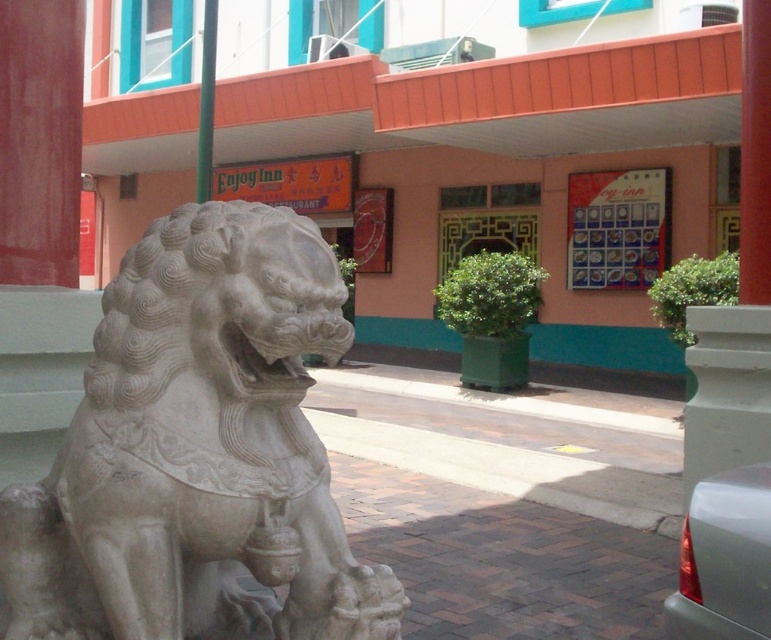
Question: Is white stone lion at left below white stone pillar at center?

Choices:
 (A) yes
 (B) no

Answer: (B)

Question: Estimate the real-world distances between objects in this image. Which object is farther from the red matte pillar at center?

Choices:
 (A) white stone lion at left
 (B) satin silver car at lower right

Answer: (A)

Question: Which point is farther to the camera?

Choices:
 (A) (709, 576)
 (B) (685, 492)

Answer: (B)

Question: From the image, what is the correct spatial relationship of satin silver car at lower right in relation to white stone pillar at center?

Choices:
 (A) left
 (B) right

Answer: (A)

Question: Estimate the real-world distances between objects in this image. Which object is closer to the white stone pillar at center?

Choices:
 (A) white stone lion at left
 (B) satin silver car at lower right
 (C) red matte pillar at center

Answer: (C)

Question: Can you confirm if white stone lion at left is positioned below satin silver car at lower right?

Choices:
 (A) yes
 (B) no

Answer: (B)